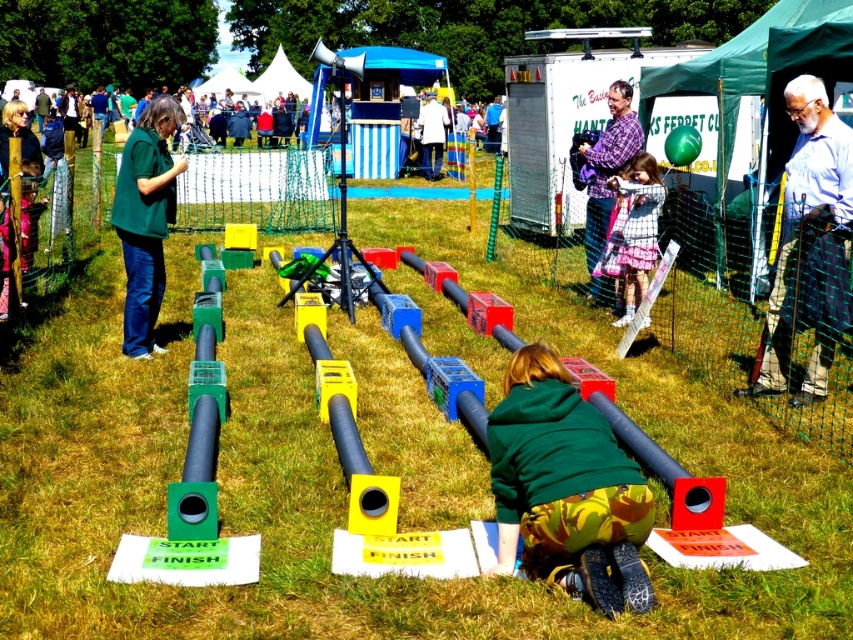
You are at the fair and see the green matte jacket at left and the plaid fabric dress at center. Which person is standing higher than the other?

The green matte jacket at left is above the plaid fabric dress at center, so the person wearing the green matte jacket at left is standing higher.

You are at the fair and see two people wearing plaid clothing. One is wearing a blue plaid kilt at right and the other is wearing a plaid fabric dress at center. Which person is wearing a wider garment?

The blue plaid kilt at right might be wider than plaid fabric dress at center.